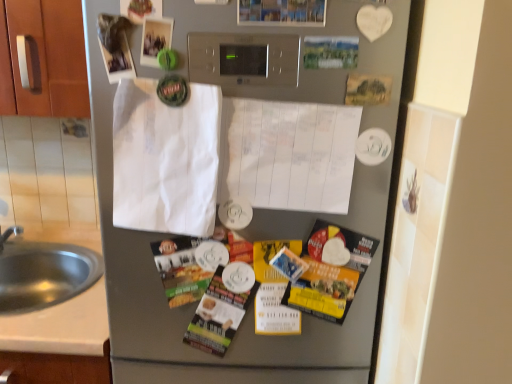
Question: Considering the positions of matte plastic magazine at center, marked as the second magazine in a left-to-right arrangement, and satin silver refrigerator at center in the image, is matte plastic magazine at center, marked as the second magazine in a left-to-right arrangement, taller or shorter than satin silver refrigerator at center?

Choices:
 (A) short
 (B) tall

Answer: (A)

Question: Is matte plastic magazine at center, positioned as the first magazine in right-to-left order, inside the boundaries of satin silver refrigerator at center, or outside?

Choices:
 (A) outside
 (B) inside

Answer: (B)

Question: Considering the real-world distances, which object is closest to the satin silver refrigerator at center?

Choices:
 (A) matte paper magazine at center, the second magazine when ordered from right to left
 (B) matte plastic magazine at center, marked as the second magazine in a left-to-right arrangement
 (C) white paper at center
 (D) white paper at center
 (E) brushed metal sink at lower left

Answer: (D)

Question: Which object is positioned closest to the matte plastic magazine at center, marked as the second magazine in a left-to-right arrangement?

Choices:
 (A) brushed metal sink at lower left
 (B) satin silver refrigerator at center
 (C) white paper at center
 (D) white paper at center
 (E) matte paper magazine at center, placed as the first magazine when sorted from left to right

Answer: (E)